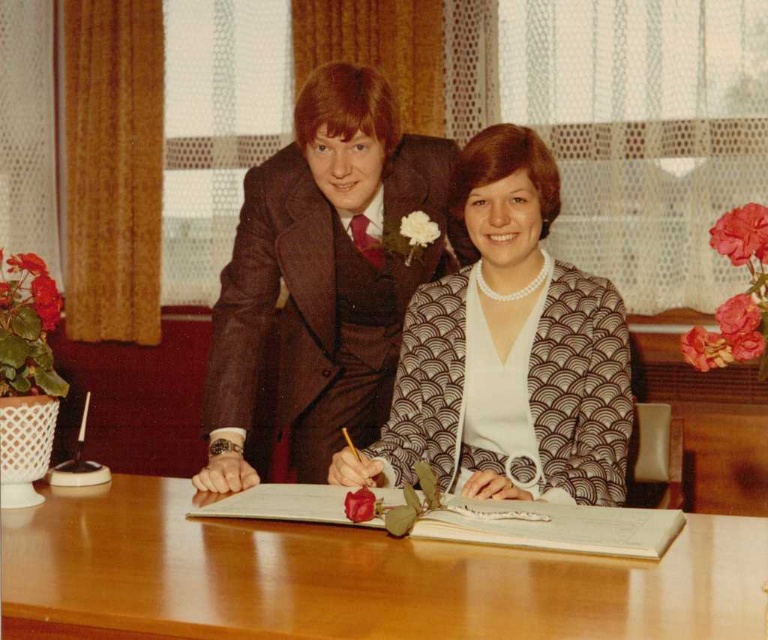
Between wooden table at center and brown textured blazer at center, which one has more height?

brown textured blazer at center

Which is in front, point (406, 570) or point (624, 442)?

Positioned in front is point (406, 570).

Identify the location of wooden table at center. The height and width of the screenshot is (640, 768). (351, 579).

Where is `wooden table at center`? Image resolution: width=768 pixels, height=640 pixels. wooden table at center is located at coordinates (351, 579).

Is wooden table at center positioned before brown textured suit at center?

Yes.

Does wooden table at center have a lesser width compared to brown textured suit at center?

Incorrect, wooden table at center's width is not less than brown textured suit at center's.

Find the location of a particular element. This screenshot has height=640, width=768. wooden table at center is located at coordinates (351, 579).

Find the location of `brown textured suit at center`. brown textured suit at center is located at coordinates (323, 276).

Is point (379, 154) more distant than point (495, 289)?

That is True.

Between point (293, 189) and point (606, 444), which one is positioned in front?

Positioned in front is point (606, 444).

What are the coordinates of `brown textured suit at center` in the screenshot? It's located at [x=323, y=276].